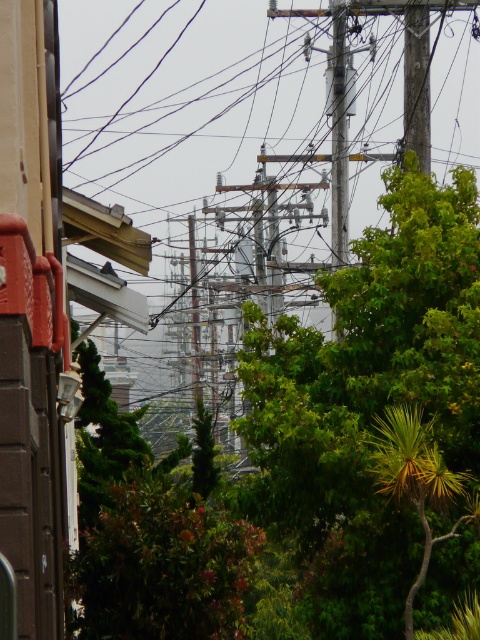
Is green leafy tree at center in front of wooden at upper center?

Yes.

Describe the element at coordinates (373, 417) in the screenshot. This screenshot has height=640, width=480. I see `green leafy tree at center` at that location.

Locate an element on the screen. The width and height of the screenshot is (480, 640). green leafy tree at center is located at coordinates pos(373,417).

Image resolution: width=480 pixels, height=640 pixels. I want to click on green leafy tree at center, so click(x=373, y=417).

Which is in front, point (470, 445) or point (435, 484)?

Positioned in front is point (435, 484).

Does point (283, 381) come closer to viewer compared to point (396, 442)?

No, (283, 381) is behind (396, 442).

Where is `green leafy tree at center`? Image resolution: width=480 pixels, height=640 pixels. green leafy tree at center is located at coordinates (373, 417).

Can you confirm if yellow-green leafy tree at right is bigger than wooden at upper center?

Yes, yellow-green leafy tree at right is bigger than wooden at upper center.

Which is above, yellow-green leafy tree at right or wooden at upper center?

wooden at upper center is above.

Between point (440, 468) and point (425, 38), which one is positioned behind?

The point (425, 38) is more distant.

At what (x,y) coordinates should I click in order to perform the action: click on yellow-green leafy tree at right. Please return your answer as a coordinate pair (x, y). This screenshot has width=480, height=640. Looking at the image, I should click on (417, 481).